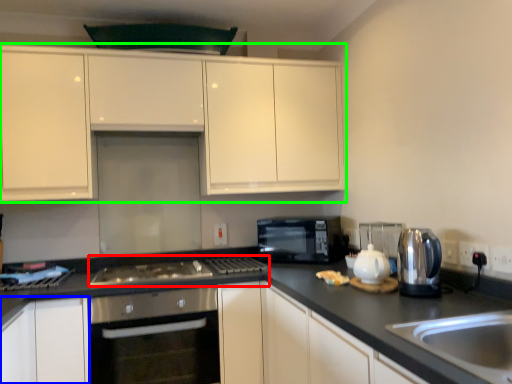
Question: Considering the real-world distances, which object is farthest from gas stove (highlighted by a red box)? cabinetry (highlighted by a blue box) or cabinetry (highlighted by a green box)?

Choices:
 (A) cabinetry
 (B) cabinetry

Answer: (B)